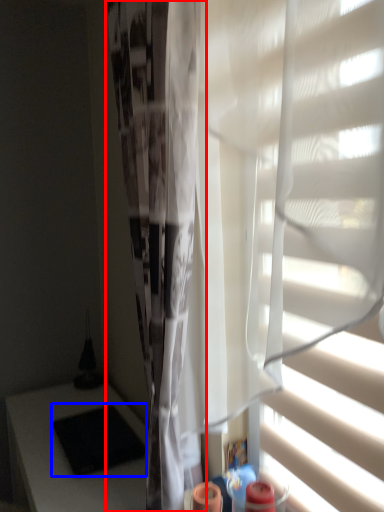
Question: Among these objects, which one is farthest to the camera, shower curtain (highlighted by a red box) or pad (highlighted by a blue box)?

Choices:
 (A) shower curtain
 (B) pad

Answer: (B)